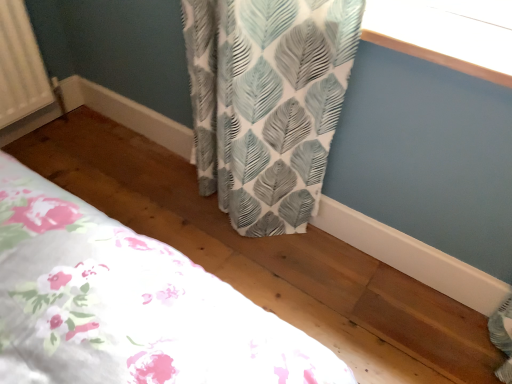
Describe the element at coordinates (127, 304) in the screenshot. This screenshot has height=384, width=512. I see `floral fabric bed at lower left` at that location.

Locate an element on the screen. The height and width of the screenshot is (384, 512). floral fabric bed at lower left is located at coordinates (127, 304).

The height and width of the screenshot is (384, 512). Find the location of `white leaf-patterned curtain at upper right`. white leaf-patterned curtain at upper right is located at coordinates [x=441, y=38].

Measure the distance between point (391, 45) and camera.

The depth of point (391, 45) is 38.78 inches.

This screenshot has height=384, width=512. What do you see at coordinates (441, 38) in the screenshot?
I see `white leaf-patterned curtain at upper right` at bounding box center [441, 38].

In order to face white leaf-patterned curtain at upper right, should I rotate leftwards or rightwards?

To face it directly, rotate right by 21.344 degrees.

Locate an element on the screen. floral fabric bed at lower left is located at coordinates (127, 304).

Is floral fabric bed at lower left to the left of white leaf-patterned curtain at upper right from the viewer's perspective?

Correct, you'll find floral fabric bed at lower left to the left of white leaf-patterned curtain at upper right.

Relative to white leaf-patterned curtain at upper right, is floral fabric bed at lower left in front or behind?

In the image, floral fabric bed at lower left appears behind white leaf-patterned curtain at upper right.

Which is in front, point (288, 332) or point (482, 32)?

The point (288, 332) is closer to the camera.

From the image's perspective, which is below, floral fabric bed at lower left or white leaf-patterned curtain at upper right?

floral fabric bed at lower left, from the image's perspective.

From a real-world perspective, which is physically below, floral fabric bed at lower left or white leaf-patterned curtain at upper right?

floral fabric bed at lower left.

Which of these two, floral fabric bed at lower left or white leaf-patterned curtain at upper right, is thinner?

white leaf-patterned curtain at upper right is thinner.

Which of these two, floral fabric bed at lower left or white leaf-patterned curtain at upper right, stands taller?

floral fabric bed at lower left.

Is floral fabric bed at lower left bigger or smaller than white leaf-patterned curtain at upper right?

floral fabric bed at lower left is bigger than white leaf-patterned curtain at upper right.

Can we say floral fabric bed at lower left lies outside white leaf-patterned curtain at upper right?

That's correct, floral fabric bed at lower left is outside of white leaf-patterned curtain at upper right.

Is floral fabric bed at lower left not near white leaf-patterned curtain at upper right?

No, floral fabric bed at lower left is in close proximity to white leaf-patterned curtain at upper right.

Is floral fabric bed at lower left looking in the opposite direction of white leaf-patterned curtain at upper right?

No, floral fabric bed at lower left's orientation is not away from white leaf-patterned curtain at upper right.

Where is `bed lying on the left of white leaf-patterned curtain at upper right`? This screenshot has width=512, height=384. bed lying on the left of white leaf-patterned curtain at upper right is located at coordinates (127, 304).

Considering the positions of objects white leaf-patterned curtain at upper right and floral fabric bed at lower left in the image provided, who is more to the left, white leaf-patterned curtain at upper right or floral fabric bed at lower left?

floral fabric bed at lower left is more to the left.

Does white leaf-patterned curtain at upper right come behind floral fabric bed at lower left?

No, white leaf-patterned curtain at upper right is in front of floral fabric bed at lower left.

Considering the points (430, 27) and (200, 336), which point is behind, point (430, 27) or point (200, 336)?

The point (430, 27) is more distant.

From the image's perspective, would you say white leaf-patterned curtain at upper right is shown under floral fabric bed at lower left?

No, from the image's perspective, white leaf-patterned curtain at upper right is not below floral fabric bed at lower left.

From a real-world perspective, is white leaf-patterned curtain at upper right physically above floral fabric bed at lower left?

Yes, from a real-world perspective, white leaf-patterned curtain at upper right is on top of floral fabric bed at lower left.

Consider the image. Does white leaf-patterned curtain at upper right have a lesser width compared to floral fabric bed at lower left?

Correct, the width of white leaf-patterned curtain at upper right is less than that of floral fabric bed at lower left.

Between white leaf-patterned curtain at upper right and floral fabric bed at lower left, which one has less height?

With less height is white leaf-patterned curtain at upper right.

Is white leaf-patterned curtain at upper right bigger than floral fabric bed at lower left?

No.

Choose the correct answer: Is white leaf-patterned curtain at upper right inside floral fabric bed at lower left or outside it?

white leaf-patterned curtain at upper right cannot be found inside floral fabric bed at lower left.

Are white leaf-patterned curtain at upper right and floral fabric bed at lower left making contact?

No.

Is white leaf-patterned curtain at upper right facing away from floral fabric bed at lower left?

No, white leaf-patterned curtain at upper right is not facing away from floral fabric bed at lower left.

What's the angular difference between white leaf-patterned curtain at upper right and floral fabric bed at lower left's facing directions?

91.8 degrees separate the facing orientations of white leaf-patterned curtain at upper right and floral fabric bed at lower left.

Locate an element on the screen. bed that is on the left side of white leaf-patterned curtain at upper right is located at coordinates (127, 304).

The width and height of the screenshot is (512, 384). I want to click on bed behind the white leaf-patterned curtain at upper right, so click(x=127, y=304).

Where is `window screen that is above the floral fabric bed at lower left (from the image's perspective)`? window screen that is above the floral fabric bed at lower left (from the image's perspective) is located at coordinates (441, 38).